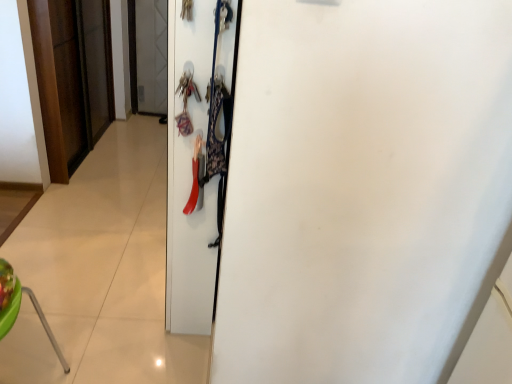
Where is `vacant area that is in front of wooden door at left, the 2th door positioned from the right`? vacant area that is in front of wooden door at left, the 2th door positioned from the right is located at coordinates (92, 196).